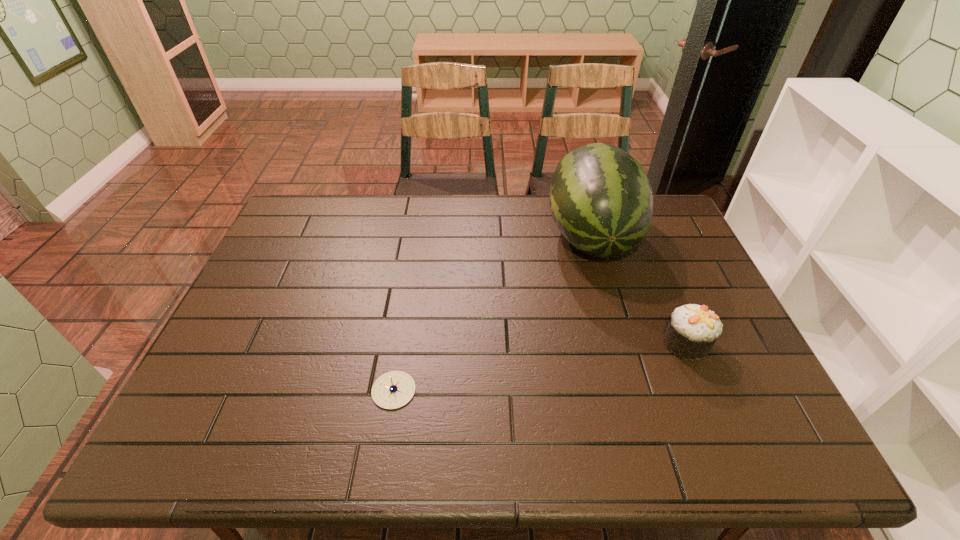
You are a GUI agent. You are given a task and a screenshot of the screen. Output one action in this format:
    pyautogui.click(x=<x>, y=<y>)
    Task: Click on the tallest object
    
    Given the screenshot: What is the action you would take?
    pyautogui.click(x=601, y=199)

I want to click on the farthest object, so click(601, 199).

The width and height of the screenshot is (960, 540). Find the location of `the second farthest object`. the second farthest object is located at coordinates (693, 329).

Find the location of `the second tallest object`. the second tallest object is located at coordinates (693, 329).

Where is `compass`? The width and height of the screenshot is (960, 540). compass is located at coordinates (394, 389).

Image resolution: width=960 pixels, height=540 pixels. In order to click on the leftmost object in this screenshot , I will do `click(394, 389)`.

Locate an element on the screen. This screenshot has height=540, width=960. free spot located on the front of the tallest object is located at coordinates (612, 310).

At what (x,y) coordinates should I click in order to perform the action: click on vacant region located on the left of the second shortest object. Please return your answer as a coordinate pair (x, y). Looking at the image, I should click on tap(632, 344).

What are the coordinates of `free space located 0.160m on the back of the shortest object` in the screenshot? It's located at (405, 321).

Where is `object present at the far edge`? This screenshot has height=540, width=960. object present at the far edge is located at coordinates (601, 199).